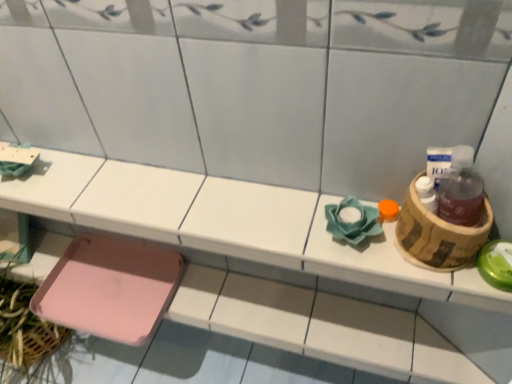
At what (x,y) coordinates should I click in order to perform the action: click on vacant space underneath pink plastic tray at lower left (from a real-world perspective). Please return your answer as a coordinate pair (x, y). Looking at the image, I should click on (287, 314).